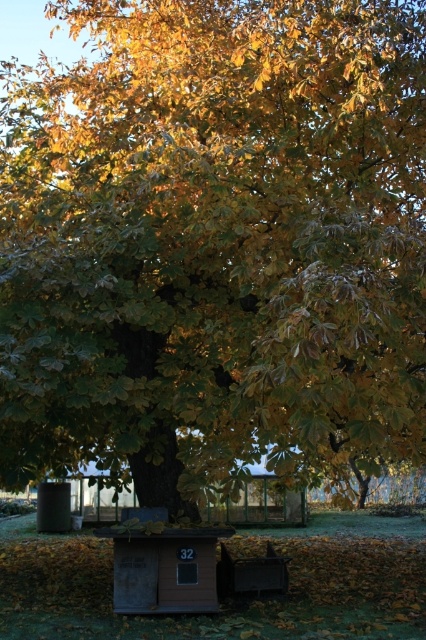
Measure the distance between wooden hut at lower center and wooden bench at lower center.

A distance of 89.20 centimeters exists between wooden hut at lower center and wooden bench at lower center.

Is wooden hut at lower center above wooden bench at lower center?

Indeed, wooden hut at lower center is positioned over wooden bench at lower center.

Who is more distant from viewer, (134, 557) or (279, 579)?

Point (279, 579)

Find the location of a particular element. This screenshot has height=640, width=426. wooden hut at lower center is located at coordinates (163, 564).